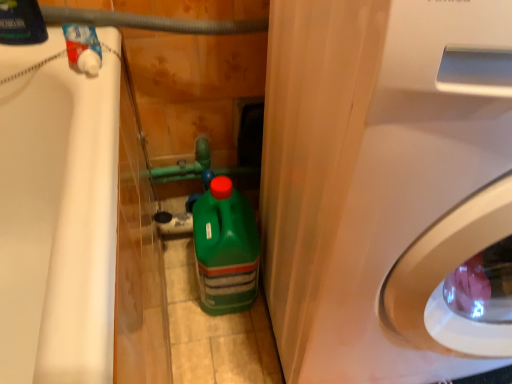
Question: Is green plastic bottle at center next to rubber hose at upper center and touching it?

Choices:
 (A) yes
 (B) no

Answer: (B)

Question: Is green plastic bottle at center further to camera compared to rubber hose at upper center?

Choices:
 (A) no
 (B) yes

Answer: (B)

Question: Can you confirm if green plastic bottle at center is taller than rubber hose at upper center?

Choices:
 (A) yes
 (B) no

Answer: (A)

Question: From a real-world perspective, is green plastic bottle at center below rubber hose at upper center?

Choices:
 (A) yes
 (B) no

Answer: (A)

Question: Considering the relative sizes of green plastic bottle at center and rubber hose at upper center in the image provided, is green plastic bottle at center wider than rubber hose at upper center?

Choices:
 (A) no
 (B) yes

Answer: (B)

Question: From a real-world perspective, is rubber hose at upper center positioned above or below green plastic bottle at center?

Choices:
 (A) above
 (B) below

Answer: (A)

Question: Is rubber hose at upper center taller or shorter than green plastic bottle at center?

Choices:
 (A) tall
 (B) short

Answer: (B)

Question: Relative to green plastic bottle at center, is rubber hose at upper center in front or behind?

Choices:
 (A) behind
 (B) front

Answer: (B)

Question: From the image's perspective, is rubber hose at upper center located above or below green plastic bottle at center?

Choices:
 (A) below
 (B) above

Answer: (B)

Question: Is green plastic bottle at center spatially inside rubber hose at upper center, or outside of it?

Choices:
 (A) outside
 (B) inside

Answer: (A)

Question: Relative to rubber hose at upper center, is green plastic bottle at center in front or behind?

Choices:
 (A) front
 (B) behind

Answer: (B)

Question: From a real-world perspective, relative to rubber hose at upper center, is green plastic bottle at center vertically above or below?

Choices:
 (A) below
 (B) above

Answer: (A)

Question: Considering the positions of green plastic bottle at center and rubber hose at upper center in the image, is green plastic bottle at center bigger or smaller than rubber hose at upper center?

Choices:
 (A) small
 (B) big

Answer: (B)

Question: Is point (57, 16) closer or farther from the camera than point (31, 39)?

Choices:
 (A) farther
 (B) closer

Answer: (A)

Question: From a real-world perspective, is rubber hose at upper center above or below matte black bottle at upper left?

Choices:
 (A) below
 (B) above

Answer: (A)